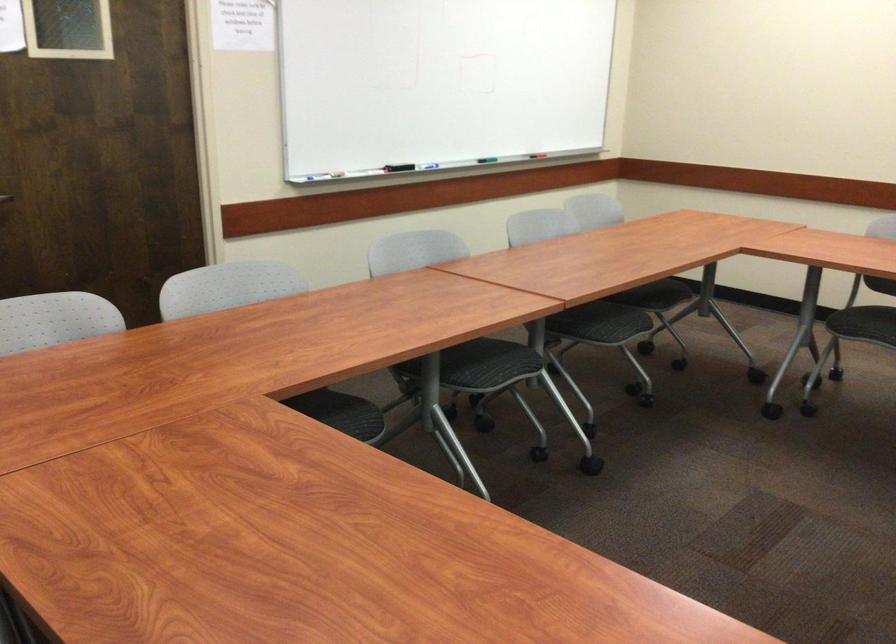
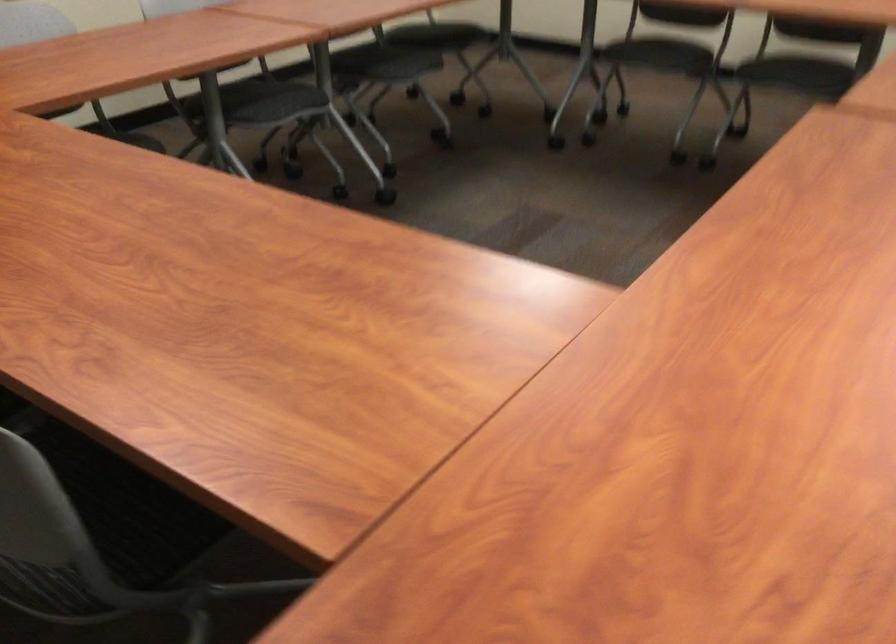
The images are taken continuously from a first-person perspective. In which direction are you moving?

The cameraman moved toward right, backward.